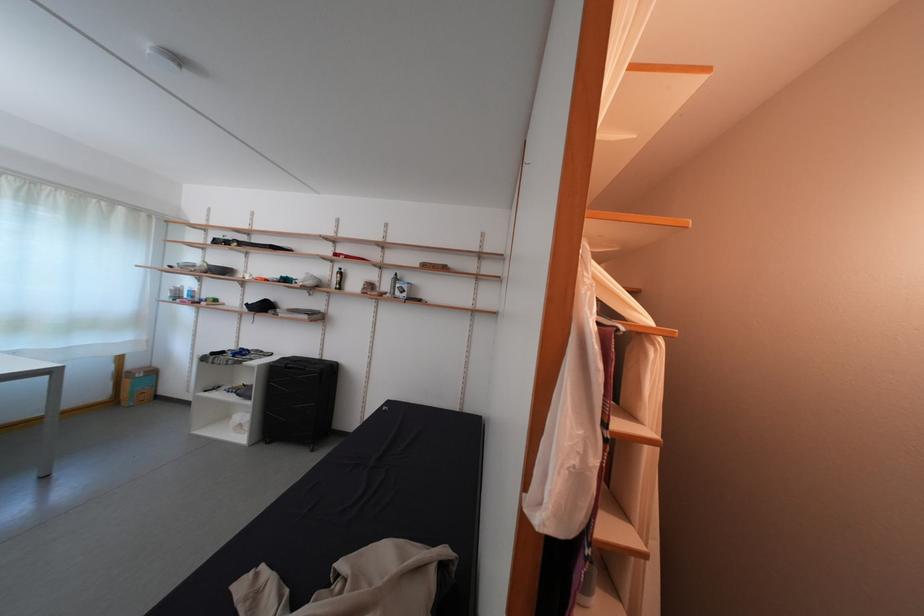
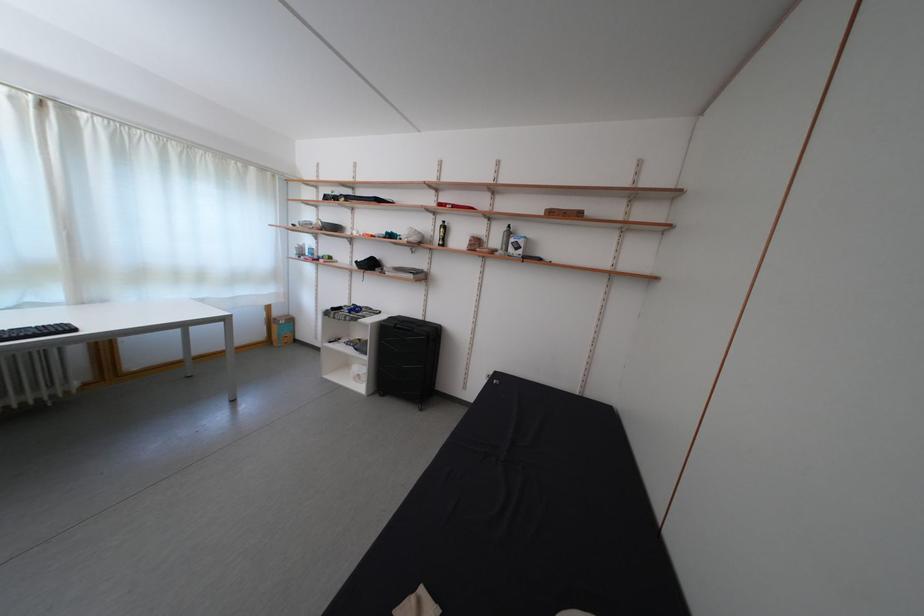
Locate, in the second image, the point that corresponds to point (293, 363) in the first image.

(399, 323)